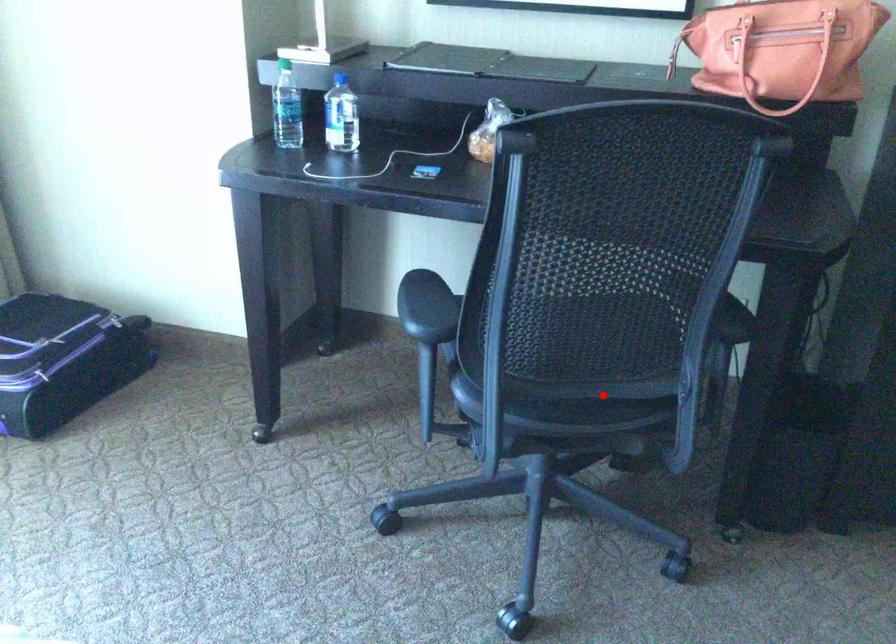
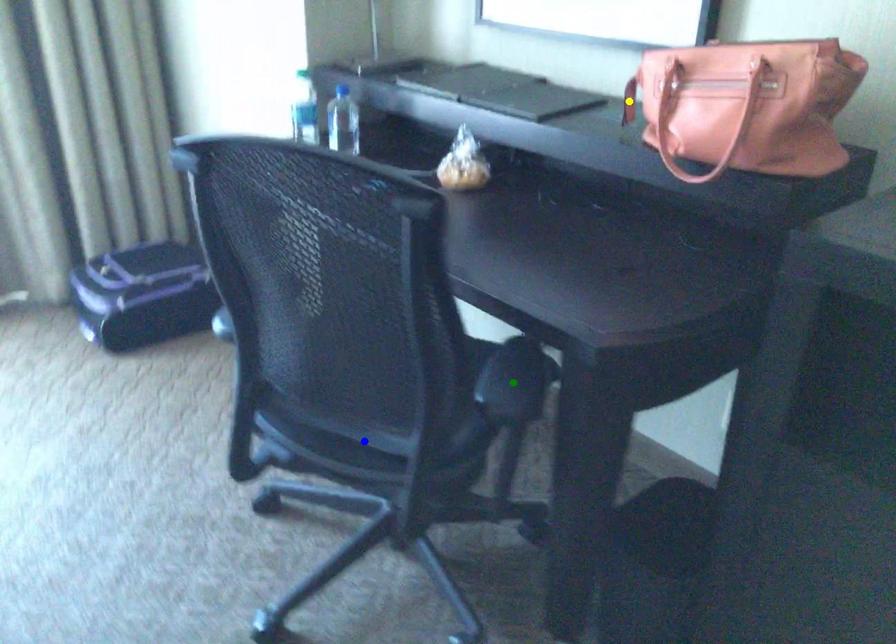
Question: I am providing you with two images of the same scene from different viewpoints. A red point is marked on the first image. You are given multiple points on the second image. Which mark in image 2 goes with the point in image 1?

Choices:
 (A) blue point
 (B) green point
 (C) yellow point

Answer: (A)